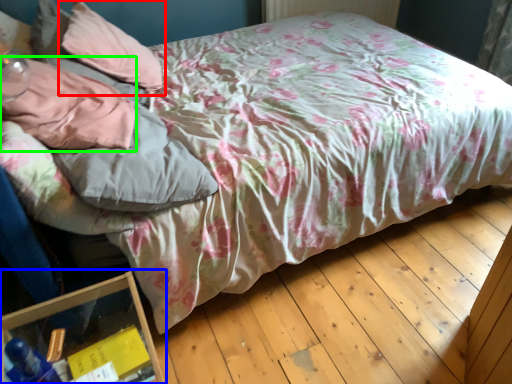
Question: Considering the real-world distances, which object is closest to pillow (highlighted by a red box)? glass box (highlighted by a blue box) or pillow (highlighted by a green box).

Choices:
 (A) glass box
 (B) pillow

Answer: (B)